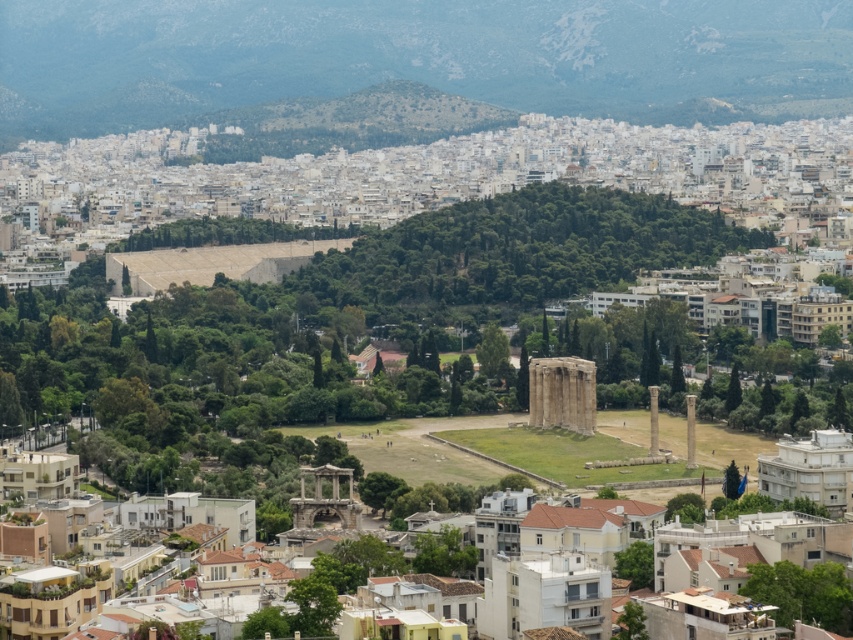
Question: In this image, where is smooth stone column at center located relative to smooth stone pillar at center?

Choices:
 (A) below
 (B) above

Answer: (B)

Question: Among these points, which one is nearest to the camera?

Choices:
 (A) (689, 433)
 (B) (653, 403)

Answer: (A)

Question: Which point appears farthest from the camera in this image?

Choices:
 (A) (650, 410)
 (B) (694, 460)

Answer: (A)

Question: Is smooth stone column at center thinner than smooth stone pillar at center?

Choices:
 (A) no
 (B) yes

Answer: (B)

Question: Is smooth stone column at center positioned behind smooth stone pillar at center?

Choices:
 (A) no
 (B) yes

Answer: (B)

Question: Which point is farther to the camera?

Choices:
 (A) (651, 419)
 (B) (693, 458)

Answer: (A)